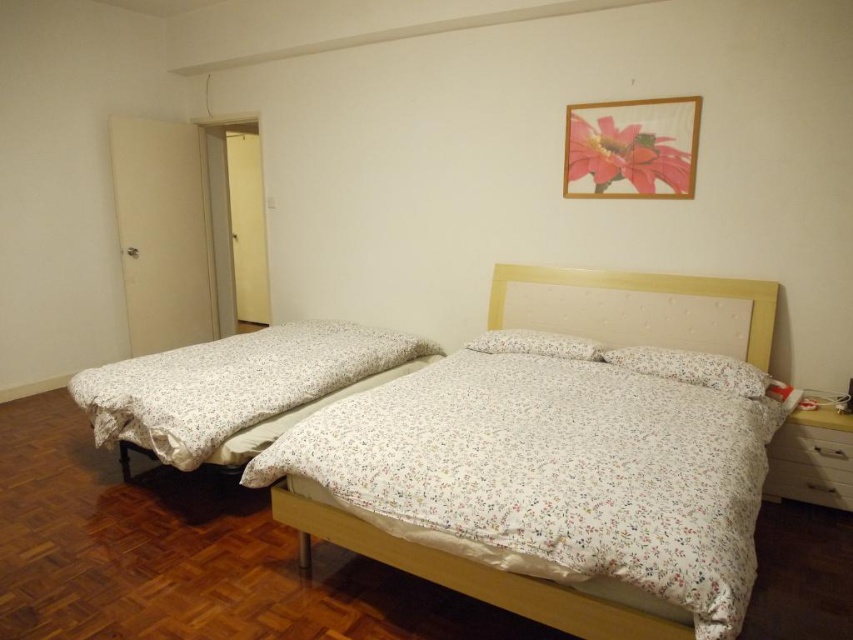
Can you confirm if white matte drawer at lower right is positioned above white floral fabric pillow at center?

Actually, white matte drawer at lower right is below white floral fabric pillow at center.

Which is more to the left, white matte drawer at lower right or white floral fabric pillow at center?

From the viewer's perspective, white floral fabric pillow at center appears more on the left side.

Is point (849, 509) closer to viewer compared to point (558, 339)?

That is True.

Identify the location of white matte drawer at lower right. The height and width of the screenshot is (640, 853). (810, 465).

Does white matte drawer at lower right appear on the right side of floral fabric pillow at center?

Indeed, white matte drawer at lower right is positioned on the right side of floral fabric pillow at center.

Locate an element on the screen. white matte drawer at lower right is located at coordinates (810, 465).

Between point (187, 353) and point (578, 268), which one is positioned in front?

Point (187, 353) is more forward.

Between white floral fabric blanket at left and white floral fabric bed at center, which one has more height?

white floral fabric blanket at left is taller.

The image size is (853, 640). What do you see at coordinates (238, 387) in the screenshot? I see `white floral fabric blanket at left` at bounding box center [238, 387].

This screenshot has width=853, height=640. In order to click on white floral fabric blanket at left in this screenshot , I will do `click(238, 387)`.